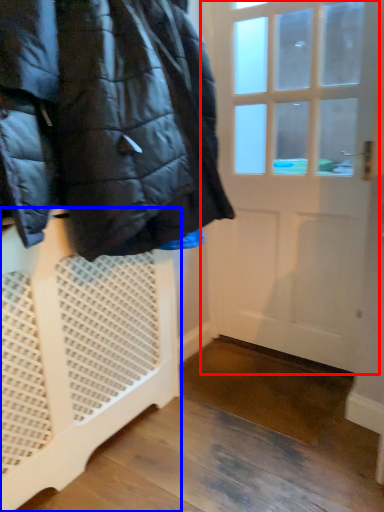
Question: Which object appears farthest to the camera in this image, door (highlighted by a red box) or furniture (highlighted by a blue box)?

Choices:
 (A) door
 (B) furniture

Answer: (A)